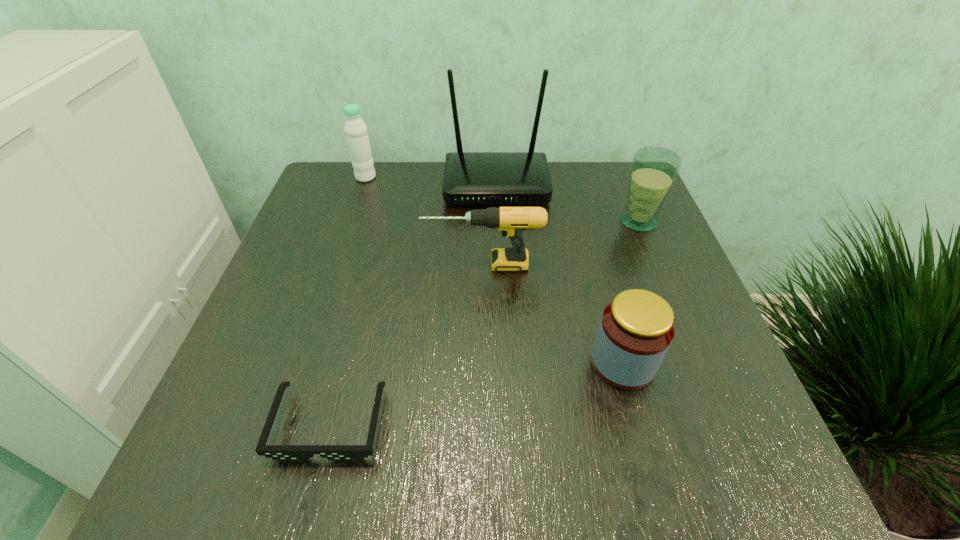
Where is `free region located 0.180m on the handle side of the drill`? free region located 0.180m on the handle side of the drill is located at coordinates (340, 265).

You are a GUI agent. You are given a task and a screenshot of the screen. Output one action in this format:
    pyautogui.click(x=<x>, y=<y>)
    Task: Click on the free space located 0.150m on the handle side of the drill
    
    Given the screenshot: What is the action you would take?
    pyautogui.click(x=354, y=265)

Find the location of a particular element. vacant space located on the back of the jar is located at coordinates (589, 241).

Image resolution: width=960 pixels, height=540 pixels. I want to click on router at the far edge, so click(x=470, y=178).

Locate an element on the screen. The height and width of the screenshot is (540, 960). water bottle that is at the far edge is located at coordinates (355, 129).

At what (x,y) coordinates should I click in order to perform the action: click on glass that is at the far edge. Please return your answer as a coordinate pair (x, y). This screenshot has width=960, height=540. Looking at the image, I should click on (654, 170).

Image resolution: width=960 pixels, height=540 pixels. In order to click on object that is at the near edge in this screenshot , I will do `click(284, 453)`.

This screenshot has height=540, width=960. What are the coordinates of `water bottle that is at the left edge` in the screenshot? It's located at (355, 129).

Locate an element on the screen. sunglasses positioned at the left edge is located at coordinates (284, 453).

At what (x,y) coordinates should I click in order to perform the action: click on glass that is at the right edge. Please return your answer as a coordinate pair (x, y). This screenshot has width=960, height=540. Looking at the image, I should click on (654, 170).